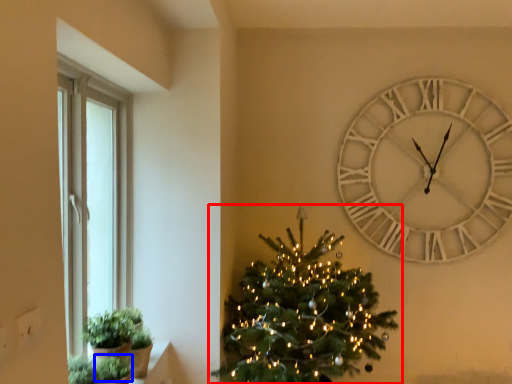
Question: Which point is closer to the camera, christmas tree (highlighted by a red box) or plant (highlighted by a blue box)?

Choices:
 (A) christmas tree
 (B) plant

Answer: (B)